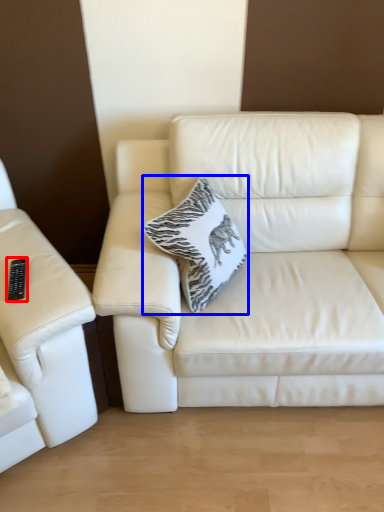
Question: Which object is further to the camera taking this photo, remote (highlighted by a red box) or throw pillow (highlighted by a blue box)?

Choices:
 (A) remote
 (B) throw pillow

Answer: (B)